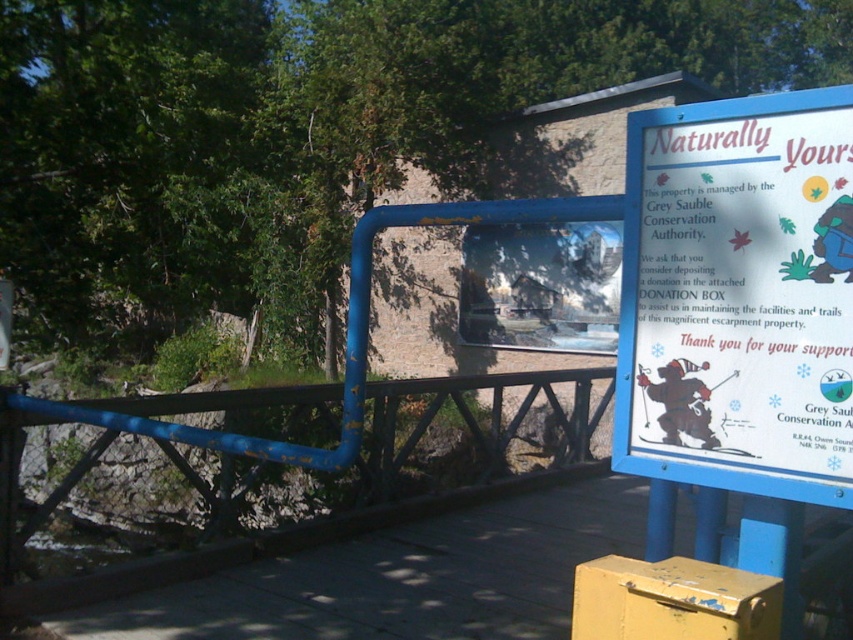
Is white paper sign at upper right taller than blue painted metal rail at center?

Yes.

In the scene shown: Who is positioned more to the right, white paper sign at upper right or blue painted metal rail at center?

From the viewer's perspective, white paper sign at upper right appears more on the right side.

Where is `white paper sign at upper right`? Image resolution: width=853 pixels, height=640 pixels. white paper sign at upper right is located at coordinates (740, 294).